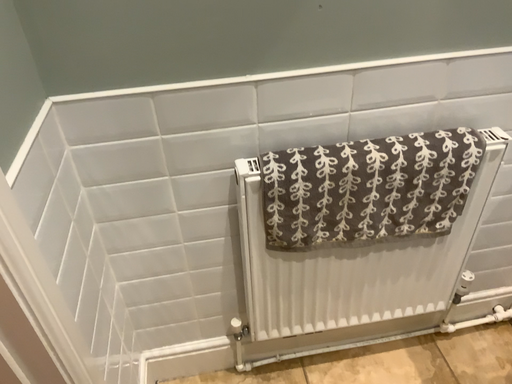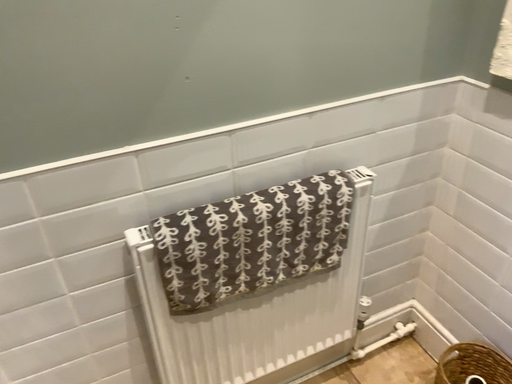
Question: Which way did the camera rotate in the video?

Choices:
 (A) rotated left
 (B) rotated right

Answer: (B)